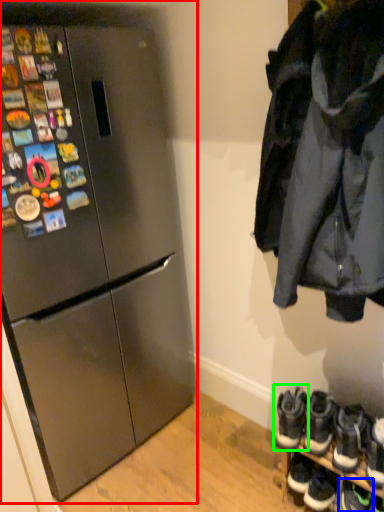
Question: Which is nearer to the refrigerator (highlighted by a red box)? footwear (highlighted by a blue box) or footwear (highlighted by a green box).

Choices:
 (A) footwear
 (B) footwear

Answer: (B)